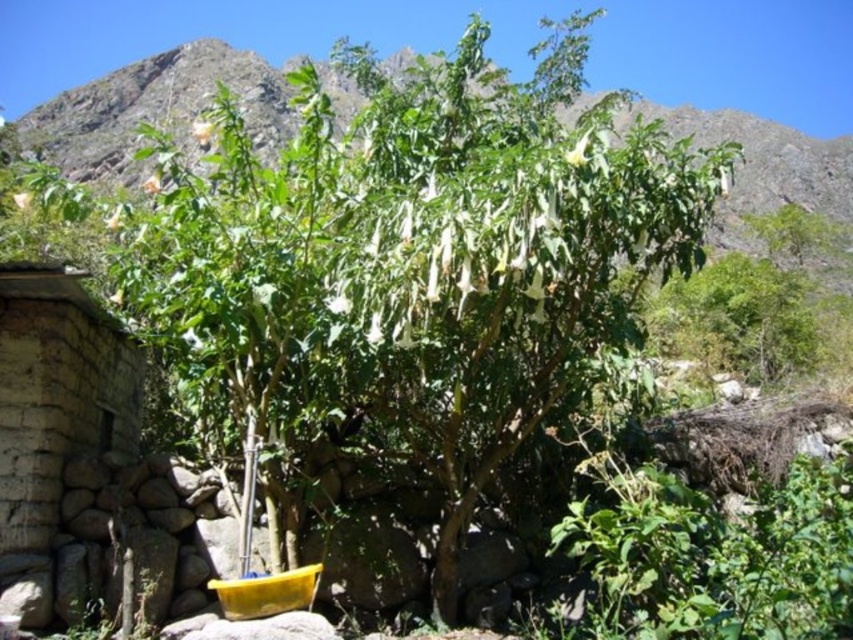
Can you confirm if green leafy plant at center is positioned to the right of stone wall at left?

Indeed, green leafy plant at center is positioned on the right side of stone wall at left.

The image size is (853, 640). What do you see at coordinates (155, 108) in the screenshot?
I see `green leafy plant at center` at bounding box center [155, 108].

You are a GUI agent. You are given a task and a screenshot of the screen. Output one action in this format:
    pyautogui.click(x=<x>, y=<y>)
    Task: Click on the green leafy plant at center
    The height and width of the screenshot is (640, 853).
    Given the screenshot: What is the action you would take?
    pyautogui.click(x=155, y=108)